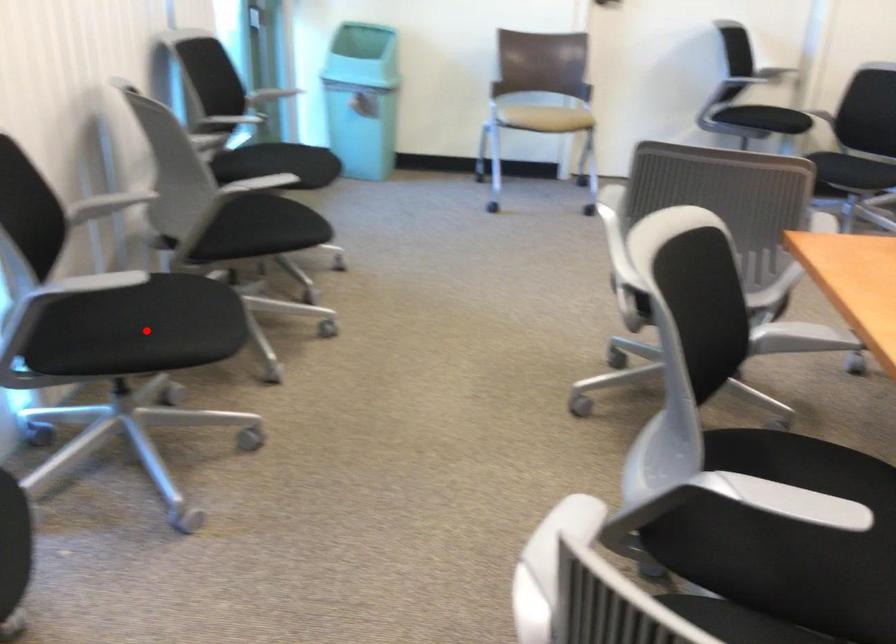
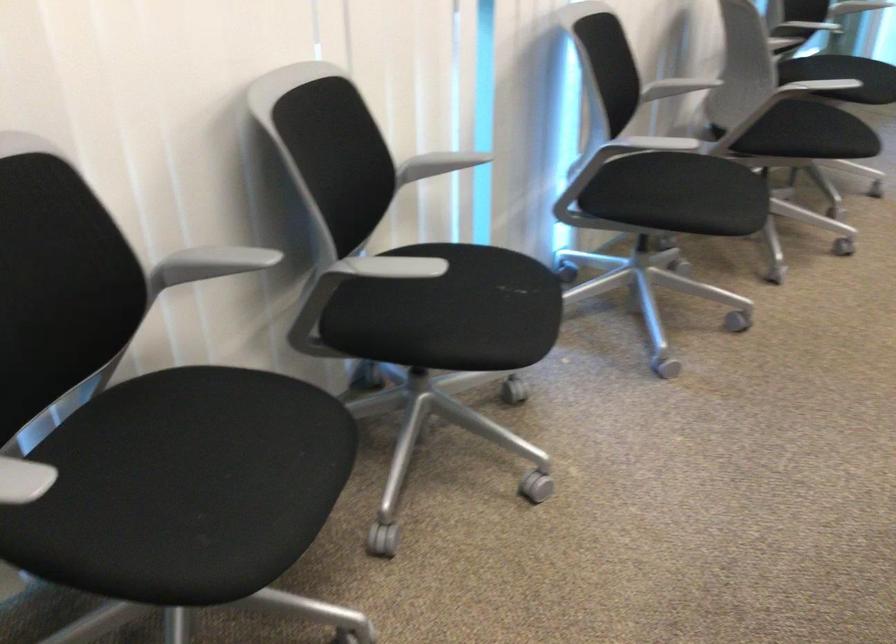
Where in the second image is the point corresponding to the highlighted location from the first image?

(679, 194)